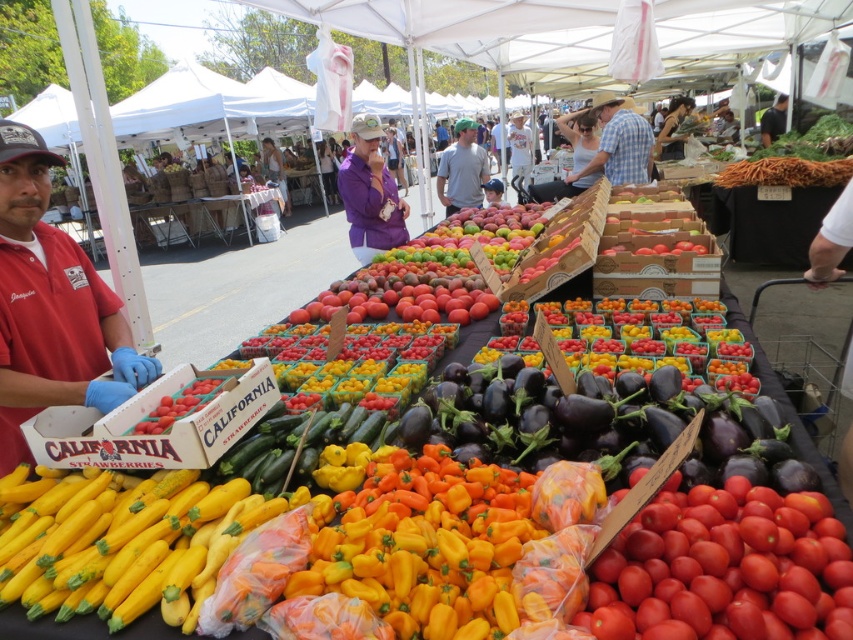
Between purple fabric shirt at center and checkered fabric shirt at center, which one has less height?

checkered fabric shirt at center

Is the position of purple fabric shirt at center more distant than that of checkered fabric shirt at center?

No, purple fabric shirt at center is in front of checkered fabric shirt at center.

Describe the element at coordinates (370, 193) in the screenshot. Image resolution: width=853 pixels, height=640 pixels. I see `purple fabric shirt at center` at that location.

Find the location of `purple fabric shirt at center`. purple fabric shirt at center is located at coordinates (370, 193).

Is red matte tomatoes at lower right shorter than purple fabric shirt at center?

Yes, red matte tomatoes at lower right is shorter than purple fabric shirt at center.

How far apart are red matte tomatoes at lower right and purple fabric shirt at center?

red matte tomatoes at lower right and purple fabric shirt at center are 3.67 meters apart.

Which is in front, point (631, 616) or point (381, 164)?

Positioned in front is point (631, 616).

Find the location of a particular element. red matte tomatoes at lower right is located at coordinates (723, 570).

Image resolution: width=853 pixels, height=640 pixels. What do you see at coordinates (619, 144) in the screenshot?
I see `checkered fabric shirt at center` at bounding box center [619, 144].

Based on the photo, who is positioned more to the left, checkered fabric shirt at center or gray cotton shirt at center?

Positioned to the left is gray cotton shirt at center.

The width and height of the screenshot is (853, 640). Describe the element at coordinates (619, 144) in the screenshot. I see `checkered fabric shirt at center` at that location.

Locate an element on the screen. This screenshot has height=640, width=853. checkered fabric shirt at center is located at coordinates (619, 144).